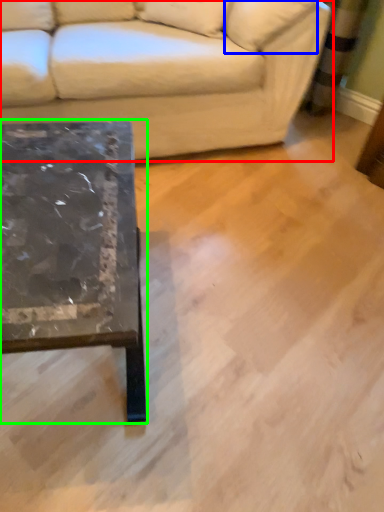
Question: Considering the real-world distances, which object is closest to studio couch (highlighted by a red box)? pillow (highlighted by a blue box) or coffee table (highlighted by a green box).

Choices:
 (A) pillow
 (B) coffee table

Answer: (A)